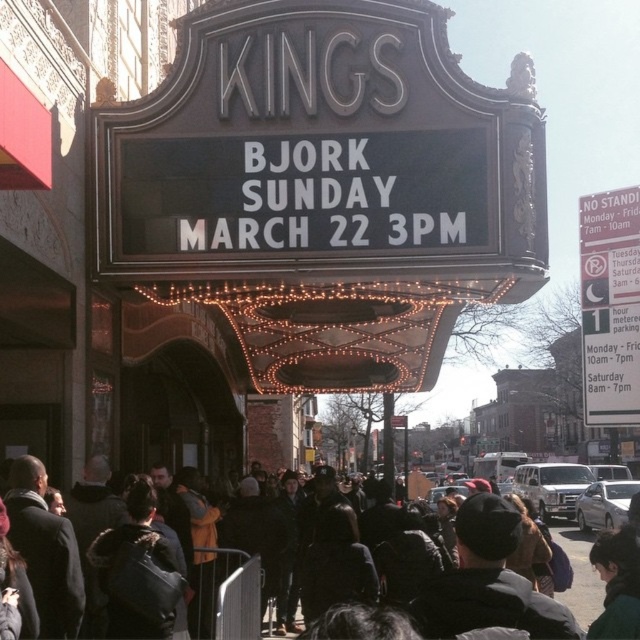
Is white paper sign at right smaller than dark gray jacket at center?

Yes.

Which of these two, white paper sign at right or dark gray jacket at center, stands shorter?

Standing shorter between the two is dark gray jacket at center.

What are the coordinates of `white paper sign at right` in the screenshot? It's located at (609, 307).